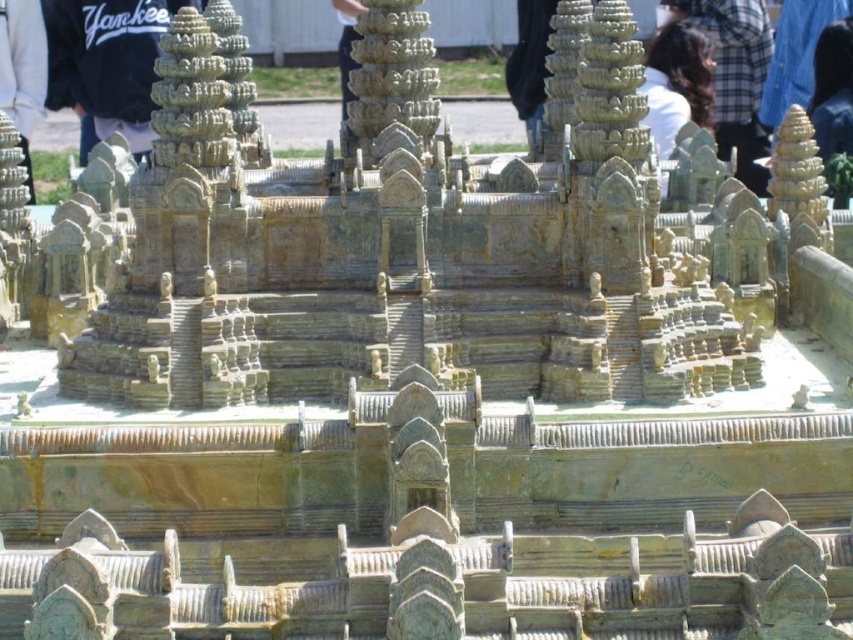
You are an art curator examining the miniature temple model. You notice two features at the top of the model, the black cotton hoodie at upper left and the brown hair at upper center. Which of these two features is shorter in height?

The black cotton hoodie at upper left has a lesser height compared to the brown hair at upper center, so the black cotton hoodie at upper left is shorter in height.

You are examining a miniature model of a temple complex. You notice two points marked on the model at coordinates point (102, 74) and point (656, 131). If you were to walk towards the temple model, which point would appear closer to you?

Point (102, 74) is further to the viewer than point (656, 131), so the point (102, 74) would appear closer to you when you walk towards the temple model.